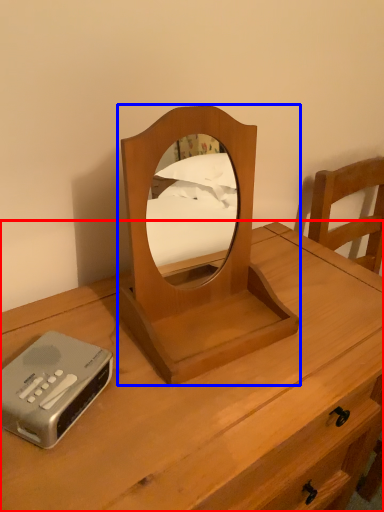
Question: Which point is closer to the camera, nightstand (highlighted by a red box) or mirror (highlighted by a blue box)?

Choices:
 (A) nightstand
 (B) mirror

Answer: (A)